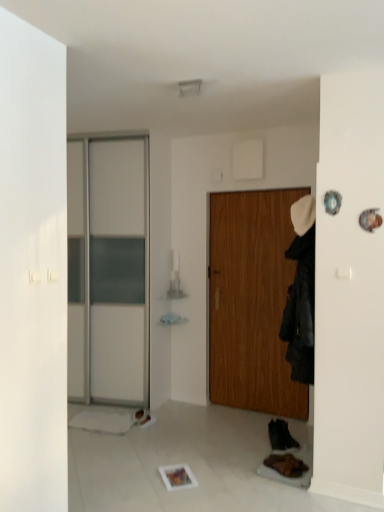
The image size is (384, 512). Find the location of `free space in front of white leather shoe at lower center, which ranks as the 1th shoe in back-to-front order`. free space in front of white leather shoe at lower center, which ranks as the 1th shoe in back-to-front order is located at coordinates (149, 430).